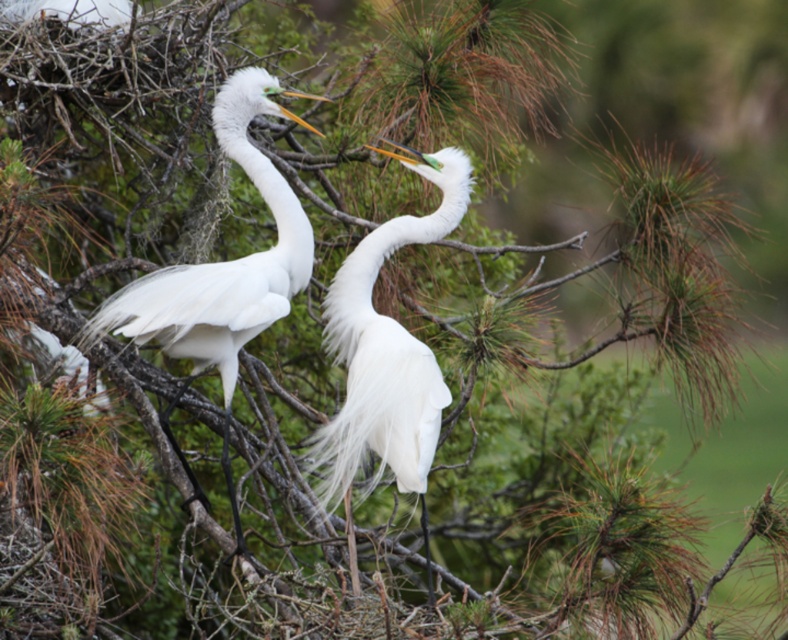
You are a birdwatcher trying to locate the white fluffy egret at center in the image. Based on the coordinates provided, can you determine its exact position relative to the center of the image?

The white fluffy egret at center is exactly at the center of the image since its coordinates are approximately (387, 355), which is very close to the center point of (394, 320).

You are a birdwatcher observing two points on a tree branch where Great Egrets are perched. The points are labeled as point (411, 422) and point (162, 422). Based on their positions, which point is nearer to you?

Point (411, 422) is closer to the viewer than point (162, 422).

You are a birdwatcher observing two egrets on a tree branch. You notice the white fluffy egret at center and the white feathered egret at center. Which of the two egrets has a thinner body?

The white fluffy egret at center is thinner than the white feathered egret at center.